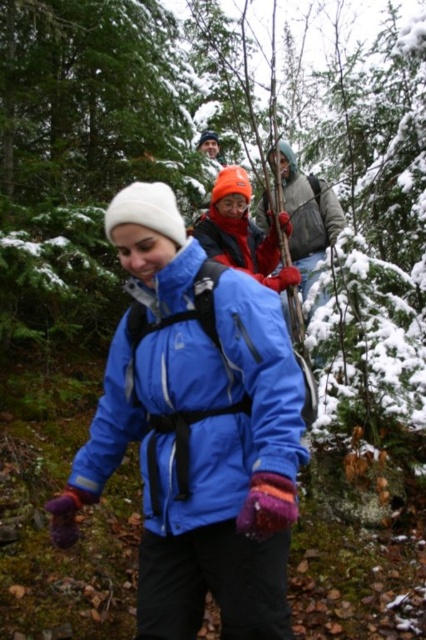
You are a photographer trying to capture a photo of the blue synthetic jacket at center and the gray fleece jacket at center. Which jacket should you focus on to ensure it appears larger in the photo?

The blue synthetic jacket at center is much taller than the gray fleece jacket at center, so focusing on the blue synthetic jacket at center will make it appear larger in the photo.

Based on the photo, you are a photographer aiming to capture a photo of the blue synthetic jacket at center and the red fleece jacket at center. Based on their positions, which jacket should you focus on first if you want to ensure both are in the frame without moving the camera?

The blue synthetic jacket at center is below the red fleece jacket at center, so you should focus on the red fleece jacket at center first to ensure both are in the frame without moving the camera.

You are a photographer capturing a group of hikers in a snowy forest. You notice the gray fleece jacket at center and the red fleece jacket at center. Which hiker should you focus on to capture a taller subject?

The gray fleece jacket at center is taller than the red fleece jacket at center, so focusing on the hiker wearing the gray fleece jacket at center will capture a taller subject.